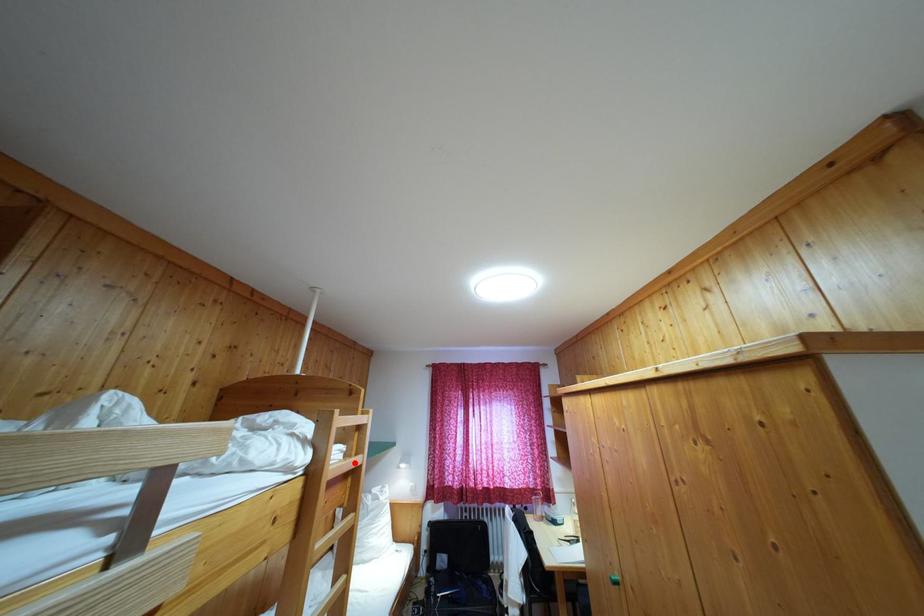
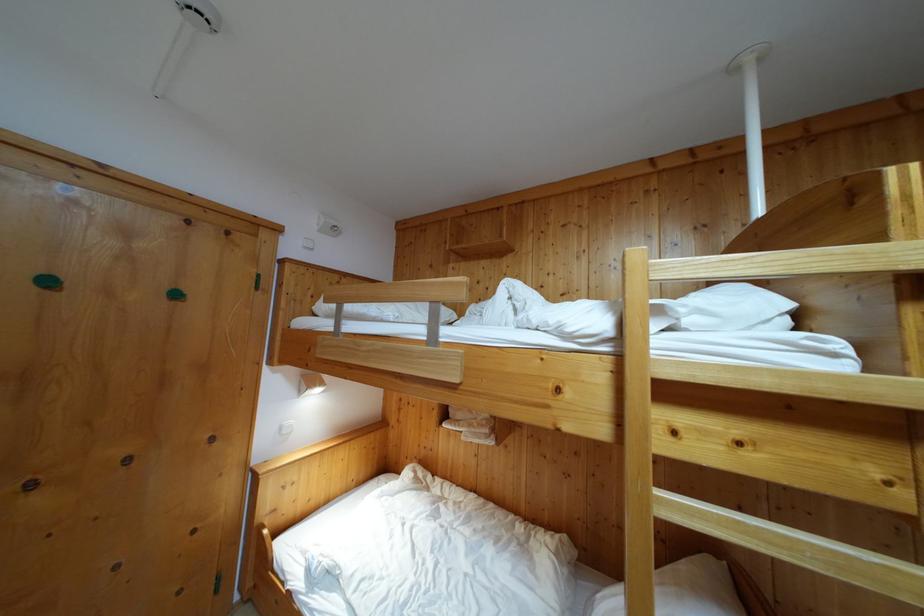
Find the pixel in the second image that matches the highlighted location in the first image.

(908, 382)